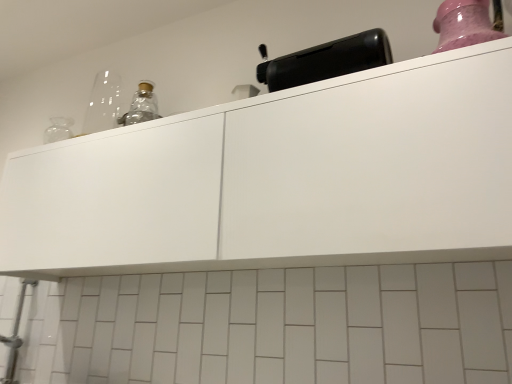
This screenshot has width=512, height=384. What do you see at coordinates (281, 179) in the screenshot?
I see `white matte cabinet at upper center` at bounding box center [281, 179].

At what (x,y) coordinates should I click in order to perform the action: click on black plastic toaster at upper center. Please return your answer as a coordinate pair (x, y). The width and height of the screenshot is (512, 384). Looking at the image, I should click on (327, 60).

Locate an element on the screen. pink glossy jar at upper right is located at coordinates (463, 24).

From a real-world perspective, is black plastic toaster at upper center located beneath white matte cabinet at upper center?

Actually, black plastic toaster at upper center is physically above white matte cabinet at upper center in the real world.

Is black plastic toaster at upper center positioned beyond the bounds of white matte cabinet at upper center?

Yes, black plastic toaster at upper center is outside of white matte cabinet at upper center.

Which is more to the right, black plastic toaster at upper center or white matte cabinet at upper center?

From the viewer's perspective, black plastic toaster at upper center appears more on the right side.

Image resolution: width=512 pixels, height=384 pixels. In order to click on bottle that is above the white matte cabinet at upper center (from a real-world perspective) in this screenshot , I will do `click(463, 24)`.

Are pink glossy jar at upper right and white matte cabinet at upper center beside each other?

There is a gap between pink glossy jar at upper right and white matte cabinet at upper center.

How distant is pink glossy jar at upper right from white matte cabinet at upper center?

pink glossy jar at upper right is 23.57 inches away from white matte cabinet at upper center.

Could you tell me if pink glossy jar at upper right is turned towards white matte cabinet at upper center?

No, pink glossy jar at upper right is not facing towards white matte cabinet at upper center.

Would you say black plastic toaster at upper center is a long distance from pink glossy jar at upper right?

No.

Can you tell me how much black plastic toaster at upper center and pink glossy jar at upper right differ in facing direction?

They differ by 0.000729 degrees in their facing directions.

From a real-world perspective, between black plastic toaster at upper center and pink glossy jar at upper right, who is vertically lower?

In real-world perspective, pink glossy jar at upper right is lower.

Which of these two, black plastic toaster at upper center or pink glossy jar at upper right, is thinner?

black plastic toaster at upper center is thinner.

From the picture: Which of these two, white matte cabinet at upper center or pink glossy jar at upper right, is smaller?

pink glossy jar at upper right is smaller.

Image resolution: width=512 pixels, height=384 pixels. I want to click on cabinetry below the pink glossy jar at upper right (from a real-world perspective), so click(x=281, y=179).

Is white matte cabinet at upper center placed right next to pink glossy jar at upper right?

No, white matte cabinet at upper center is not making contact with pink glossy jar at upper right.

Is point (165, 246) farther from viewer compared to point (478, 42)?

Yes, it is behind point (478, 42).

Find the location of a particular element. The image size is (512, 384). appliance above the white matte cabinet at upper center (from the image's perspective) is located at coordinates (327, 60).

Between white matte cabinet at upper center and black plastic toaster at upper center, which one has smaller width?

With smaller width is black plastic toaster at upper center.

In the scene shown: Does white matte cabinet at upper center lie in front of black plastic toaster at upper center?

Yes.

From the image's perspective, which is below, white matte cabinet at upper center or black plastic toaster at upper center?

From the image's view, white matte cabinet at upper center is below.

Identify the location of bottle below the black plastic toaster at upper center (from a real-world perspective). (463, 24).

Is pink glossy jar at upper right to the left of black plastic toaster at upper center from the viewer's perspective?

Incorrect, pink glossy jar at upper right is not on the left side of black plastic toaster at upper center.

Looking at this image, who is smaller, pink glossy jar at upper right or black plastic toaster at upper center?

pink glossy jar at upper right.

I want to click on cabinetry that is on the left side of black plastic toaster at upper center, so click(x=281, y=179).

Locate an element on the screen. This screenshot has height=384, width=512. cabinetry below the pink glossy jar at upper right (from a real-world perspective) is located at coordinates (281, 179).

From the image, which object appears to be nearer to pink glossy jar at upper right, black plastic toaster at upper center or white matte cabinet at upper center?

Based on the image, black plastic toaster at upper center appears to be nearer to pink glossy jar at upper right.

Looking at the image, which one is located further to pink glossy jar at upper right, white matte cabinet at upper center or black plastic toaster at upper center?

white matte cabinet at upper center lies further to pink glossy jar at upper right than the other object.

Estimate the real-world distances between objects in this image. Which object is closer to black plastic toaster at upper center, pink glossy jar at upper right or white matte cabinet at upper center?

pink glossy jar at upper right is positioned closer to the anchor black plastic toaster at upper center.

Considering their positions, is black plastic toaster at upper center positioned closer to white matte cabinet at upper center than pink glossy jar at upper right?

black plastic toaster at upper center is closer to white matte cabinet at upper center.

Estimate the real-world distances between objects in this image. Which object is further from white matte cabinet at upper center, pink glossy jar at upper right or black plastic toaster at upper center?

pink glossy jar at upper right is further to white matte cabinet at upper center.

Considering their positions, is white matte cabinet at upper center positioned further to black plastic toaster at upper center than pink glossy jar at upper right?

Among the two, white matte cabinet at upper center is located further to black plastic toaster at upper center.

Image resolution: width=512 pixels, height=384 pixels. I want to click on appliance between white matte cabinet at upper center and pink glossy jar at upper right, so coord(327,60).